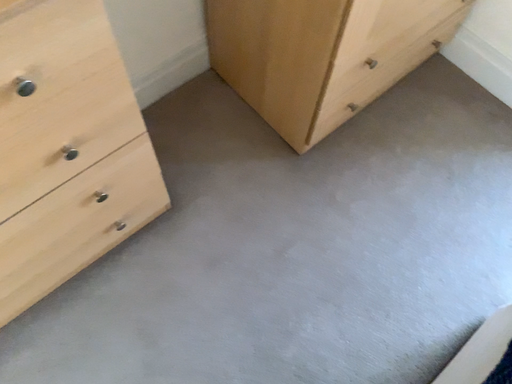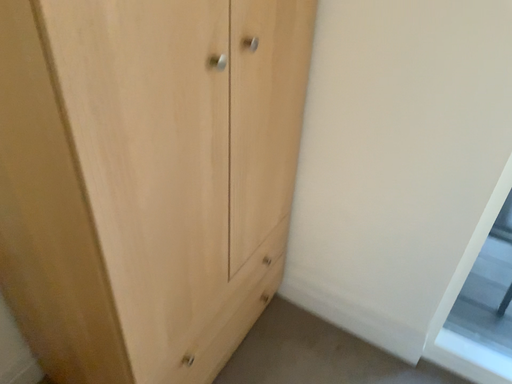
Question: Which way did the camera rotate in the video?

Choices:
 (A) rotated right
 (B) rotated left

Answer: (A)